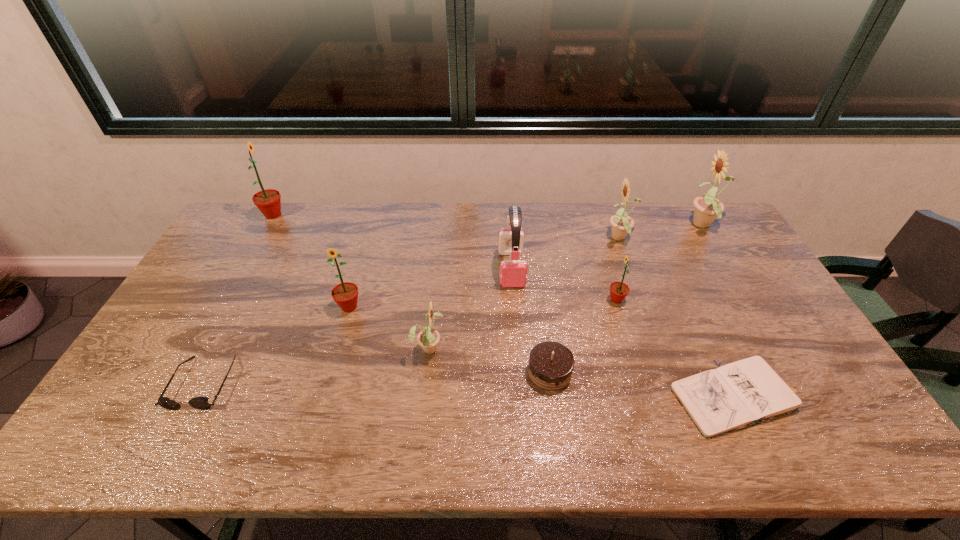
Locate an element on the screen. green sunflower that is the third closest to the seventh nearest object is located at coordinates (268, 201).

You are a GUI agent. You are given a task and a screenshot of the screen. Output one action in this format:
    pyautogui.click(x=<x>, y=<y>)
    Task: Click on the vacant space that satisfies the following two spatial constraints: 1. on the front-facing side of the nearest sunflower; 2. on the back side of the notebook
    This screenshot has height=540, width=960.
    Given the screenshot: What is the action you would take?
    pyautogui.click(x=423, y=397)

Find the location of a particular element. The height and width of the screenshot is (540, 960). blank area in the image that satisfies the following two spatial constraints: 1. on the front-facing side of the second biggest yellow sunflower; 2. on the right side of the shortest object is located at coordinates (677, 397).

In order to click on free space that satisfies the following two spatial constraints: 1. on the face of the chocolate cake; 2. on the left side of the second green sunflower from right to left in this screenshot , I will do `click(330, 372)`.

This screenshot has height=540, width=960. In order to click on blank space that satisfies the following two spatial constraints: 1. on the face of the shortest object; 2. on the right side of the second biggest green sunflower in this screenshot , I will do `click(324, 397)`.

I want to click on vacant point that satisfies the following two spatial constraints: 1. on the outer surface of the shortest object; 2. on the right side of the pink earphone, so click(521, 397).

You are a GUI agent. You are given a task and a screenshot of the screen. Output one action in this format:
    pyautogui.click(x=<x>, y=<y>)
    Task: Click on the vacant position in the image that satisfies the following two spatial constraints: 1. on the front-facing side of the second yellow sunflower from left to right; 2. on the front-facing side of the sunglasses
    The width and height of the screenshot is (960, 540).
    Given the screenshot: What is the action you would take?
    pyautogui.click(x=672, y=383)

The width and height of the screenshot is (960, 540). Find the location of `blank space that satisfies the following two spatial constraints: 1. on the front-facing side of the second biggest yellow sunflower; 2. on the face of the second smallest green sunflower`. blank space that satisfies the following two spatial constraints: 1. on the front-facing side of the second biggest yellow sunflower; 2. on the face of the second smallest green sunflower is located at coordinates (644, 307).